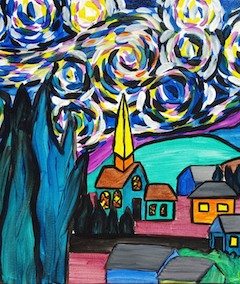
What are the coordinates of `artwork` in the screenshot? It's located at (170, 73).